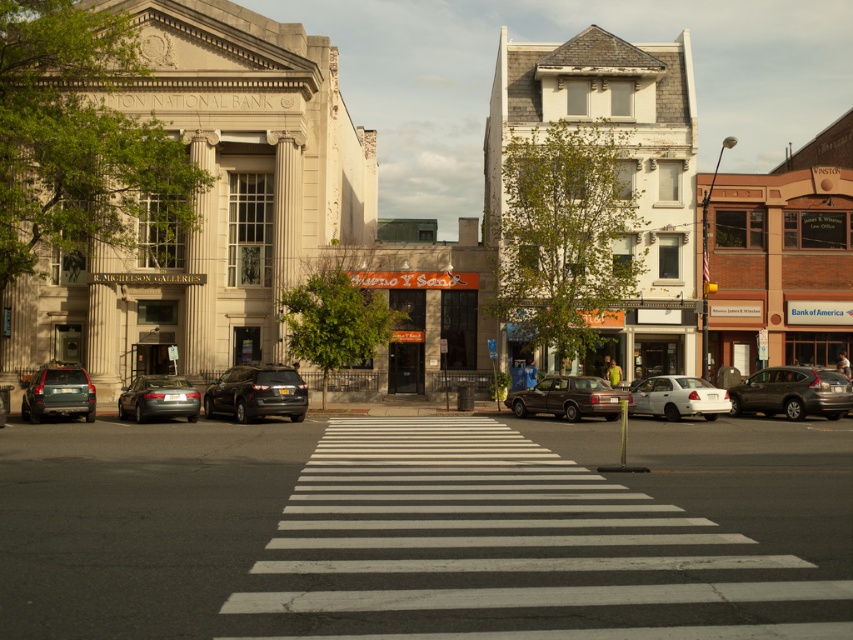
Question: Which object is closer to the camera taking this photo?

Choices:
 (A) brown matte sedan at center
 (B) matte gray suv at left
 (C) silver metallic sedan at center

Answer: (C)

Question: Does white painted crosswalk at center appear under metallic gray suv at center right?

Choices:
 (A) no
 (B) yes

Answer: (A)

Question: Does shiny black suv at center appear on the left side of white matte sedan at center?

Choices:
 (A) no
 (B) yes

Answer: (B)

Question: Which of the following is the closest to the observer?

Choices:
 (A) (165, 404)
 (B) (293, 410)

Answer: (A)

Question: Which of these objects is positioned closest to the brown matte sedan at center?

Choices:
 (A) shiny black suv at center
 (B) white matte sedan at center
 (C) white painted crosswalk at center
 (D) matte gray suv at left

Answer: (B)

Question: Is white painted crosswalk at center to the left of brown matte sedan at center from the viewer's perspective?

Choices:
 (A) yes
 (B) no

Answer: (A)